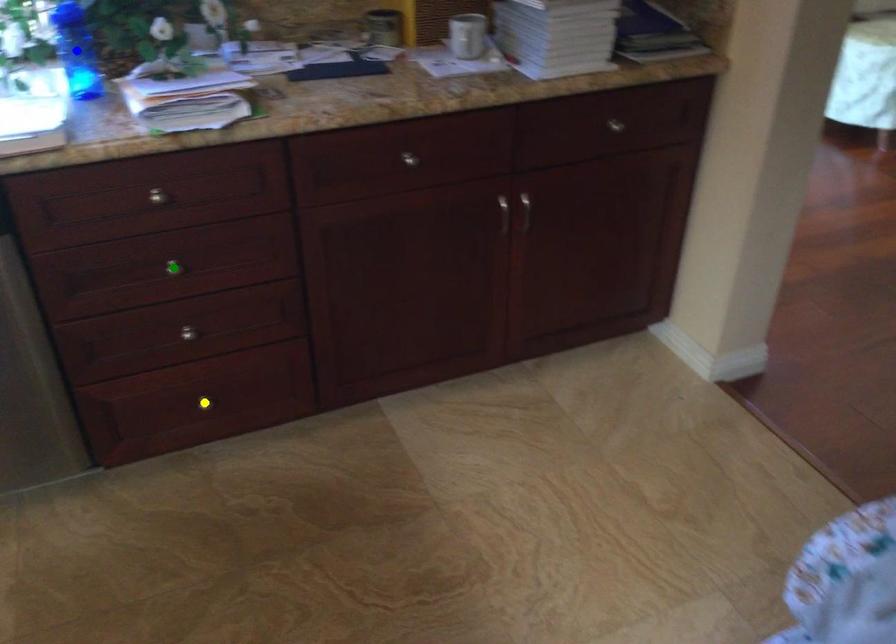
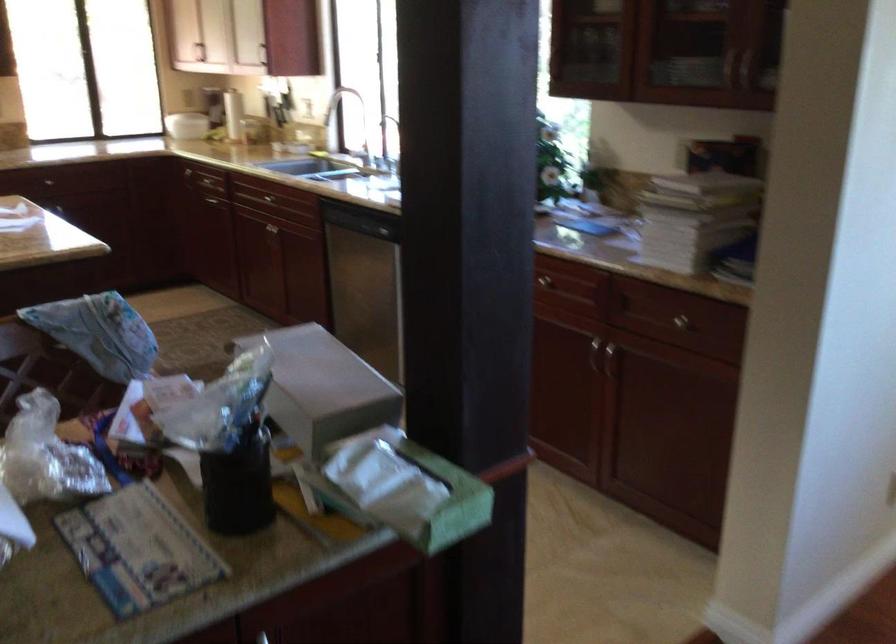
I am providing you with two images of the same scene from different viewpoints. Three points are marked in image1. Which point corresponds to a part or object that is occluded in image2?In image1, three points are marked. Which of them correspond to a part or object that is occluded in image2?Among the three points shown in image1, which one corresponds to a part or object that is no longer visible due to occlusion in image2?

Invisible in image2: green point, yellow point, blue point.